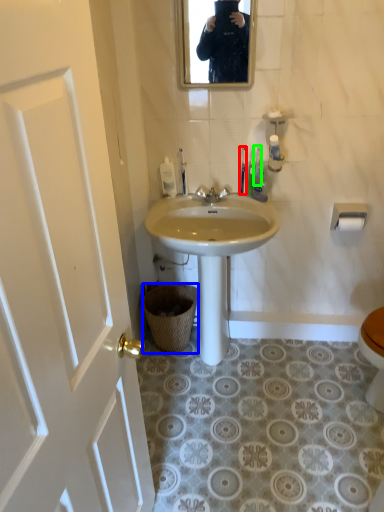
Question: Which is farther away from toilet brush (highlighted by a red box)? trash bin/can (highlighted by a blue box) or toiletry (highlighted by a green box)?

Choices:
 (A) trash bin/can
 (B) toiletry

Answer: (A)